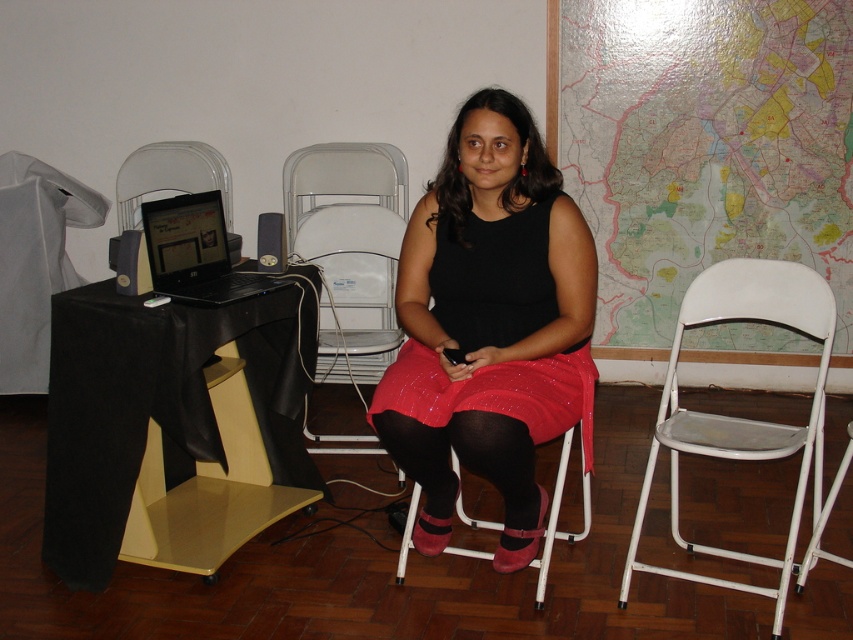
Does matte black dress at center have a lesser width compared to matte black laptop at left?

No.

Identify the location of matte black dress at center. (489, 324).

I want to click on matte black dress at center, so click(x=489, y=324).

Which is behind, point (160, 262) or point (566, 461)?

The point (160, 262) is more distant.

Who is shorter, matte black laptop at left or pink fabric stool at center?

Standing shorter between the two is matte black laptop at left.

Locate an element on the screen. matte black laptop at left is located at coordinates tap(195, 252).

At what (x,y) coordinates should I click in order to perform the action: click on matte black laptop at left. Please return your answer as a coordinate pair (x, y). This screenshot has width=853, height=640. Looking at the image, I should click on pyautogui.click(x=195, y=252).

Which is in front, point (419, 246) or point (555, 504)?

Positioned in front is point (419, 246).

Consider the image. Does matte black dress at center appear on the left side of pink fabric stool at center?

Indeed, matte black dress at center is positioned on the left side of pink fabric stool at center.

Who is more distant from viewer, (x=590, y=300) or (x=554, y=524)?

The point (x=554, y=524) is more distant.

Identify the location of matte black dress at center. (489, 324).